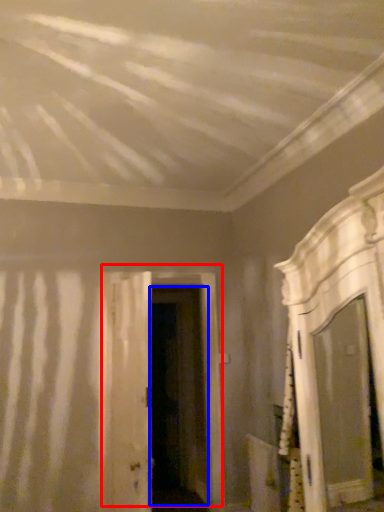
Question: Which object appears closest to the camera in this image, door (highlighted by a red box) or door (highlighted by a blue box)?

Choices:
 (A) door
 (B) door

Answer: (A)